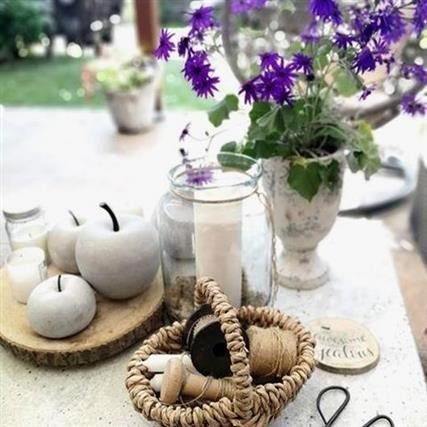
At what (x,y) coordinates should I click in order to perform the action: click on candles. Please return your answer as a coordinate pair (x, y). Looking at the image, I should click on (23, 260), (29, 236), (215, 223), (157, 363), (157, 381).